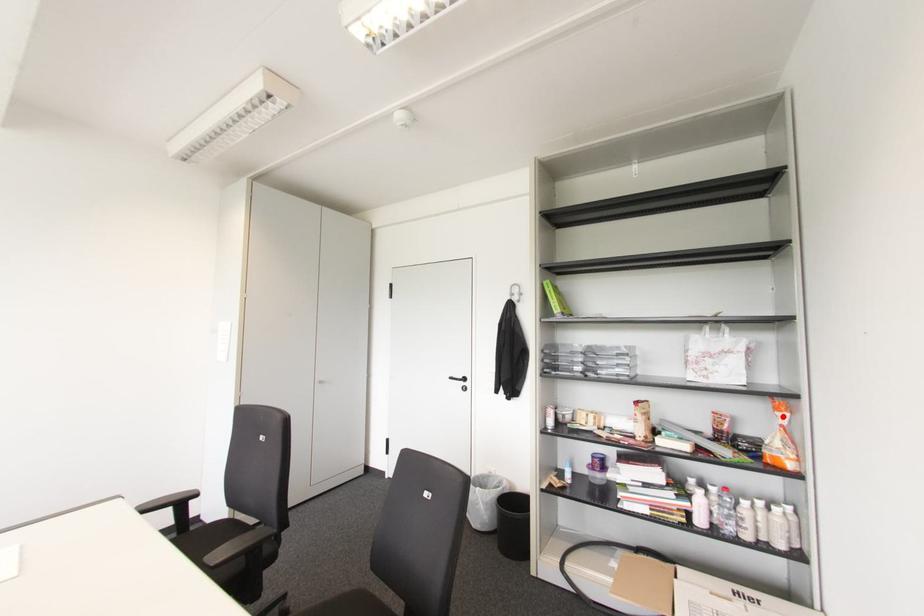
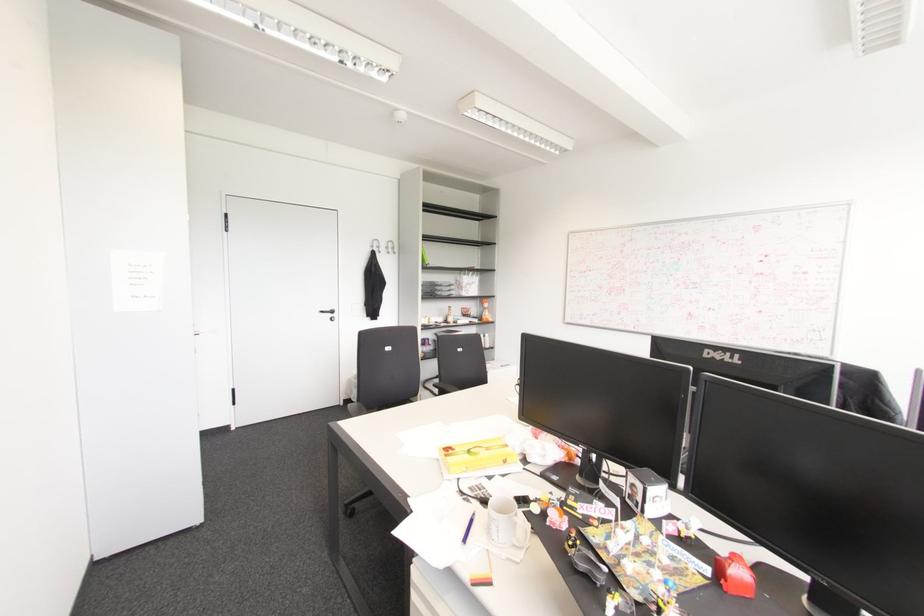
Question: I am providing you with two images of the same scene from different viewpoints. A red point is marked on the first image. Can you still see the location of the red point in image 2?

Choices:
 (A) Yes
 (B) No

Answer: (A)